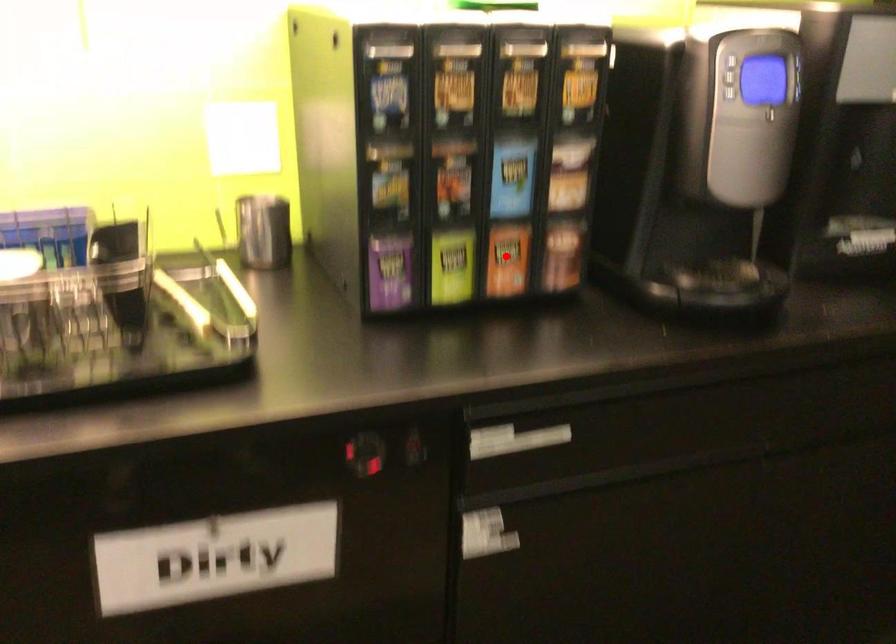
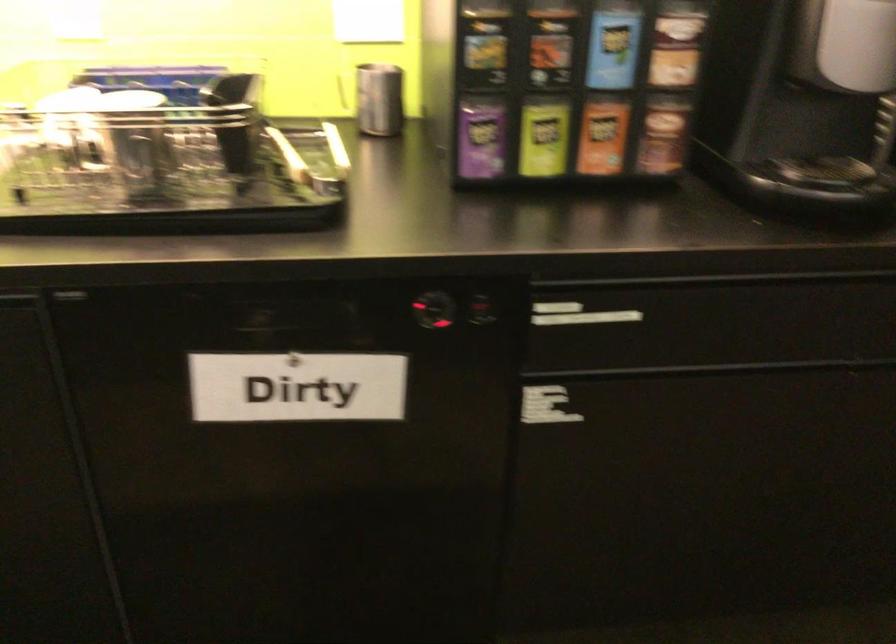
Question: I am providing you with two images of the same scene from different viewpoints. A red point is marked on the first image. At the location where the point appears in image 1, is it still visible in image 2?

Choices:
 (A) Yes
 (B) No

Answer: (A)